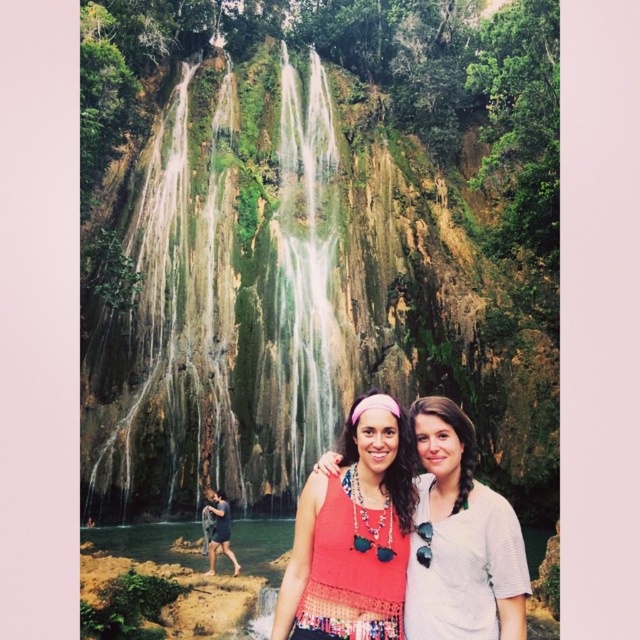
You are a photographer trying to capture both the crochet tank top at center and the white textured shirt at center in the same frame. Given that your camera has a maximum focus range of 4 meters, will you be able to include both subjects in a single photo without moving closer?

The crochet tank top at center and white textured shirt at center are 4.12 meters apart from each other, which exceeds the camera maximum focus range of 4 meters. Therefore, you cannot include both subjects in a single photo without moving closer.

You are a photographer trying to capture a photo of the two people in the scene. You notice the crochet tank top at center and dark blue shorts at lower left. Which clothing item is taller in the image?

The crochet tank top at center is taller than dark blue shorts at lower left, so the crochet tank top at center is the taller clothing item in the image.

You are a photographer trying to capture a clear shot of both the crochet tank top at center and the white textured shirt at center. Since you want to focus on the top part of their clothing, which one should you adjust your camera focus to prioritize in terms of height?

The crochet tank top at center has a greater height compared to the white textured shirt at center, so you should prioritize focusing on the crochet tank top at center to ensure the top part of their clothing is clear.